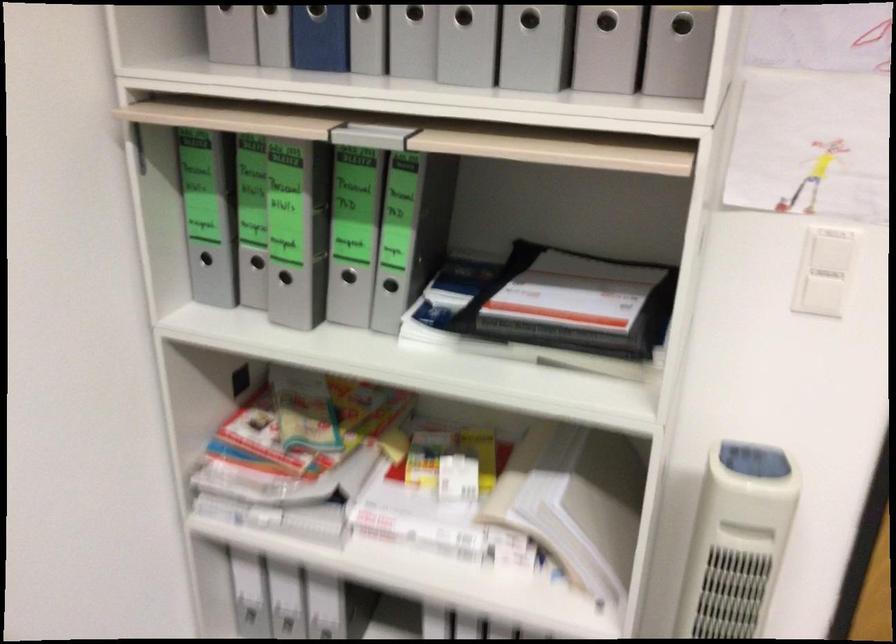
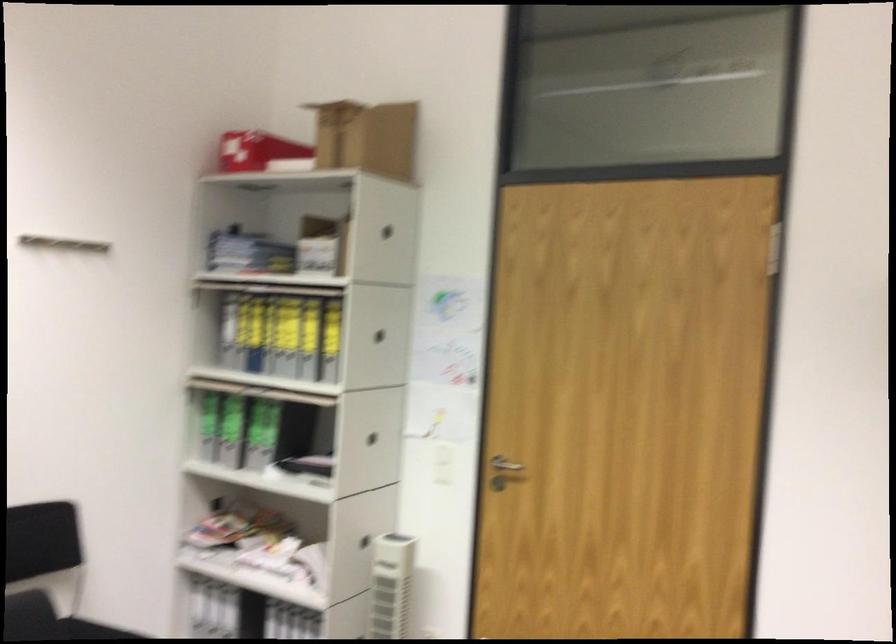
In the second image, find the point that corresponds to point 377,292 in the first image.

(265, 453)